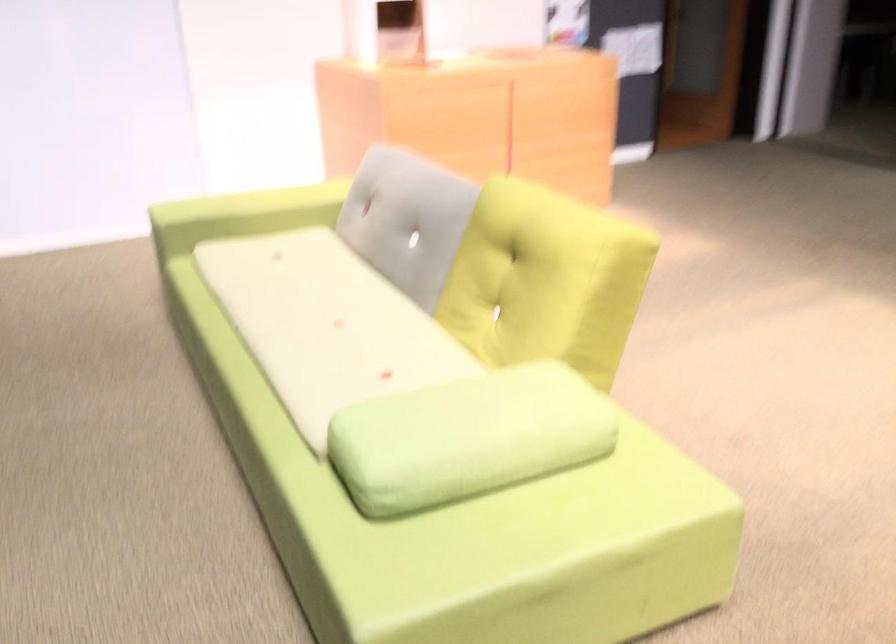
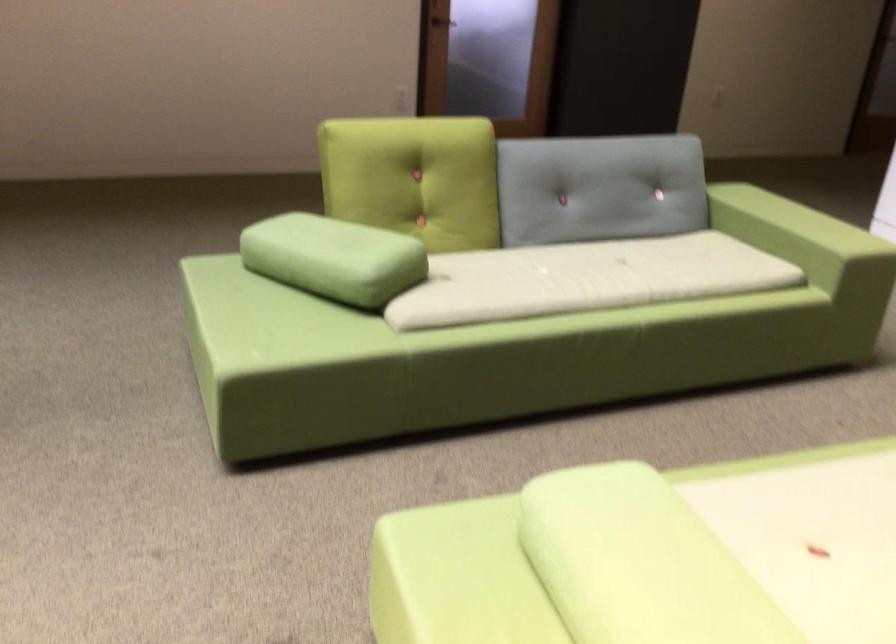
Where in the second image is the point corresponding to the point at 479,412 from the first image?

(639, 563)